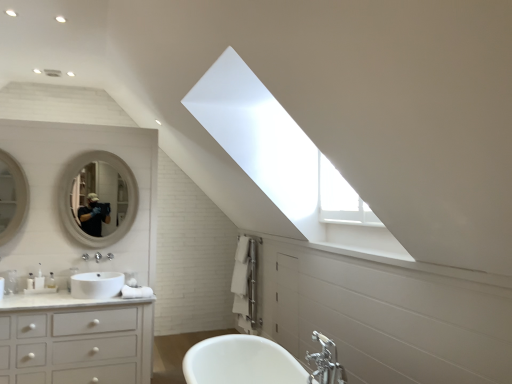
The height and width of the screenshot is (384, 512). In order to click on empty space that is ontop of white glossy mirror at upper left, acting as the 1th mirror starting from the back (from a real-world perspective) in this screenshot , I will do `click(101, 147)`.